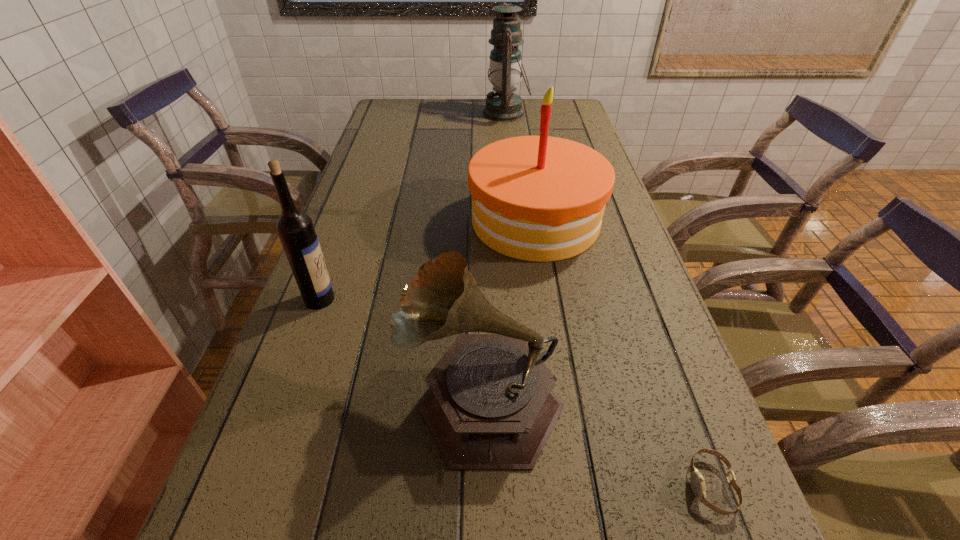
Identify the location of blank region between the shortest object and the second farthest object. The height and width of the screenshot is (540, 960). (623, 353).

Image resolution: width=960 pixels, height=540 pixels. I want to click on free point between the phonograph record and the leftmost object, so click(x=400, y=348).

Choose which object is the third nearest neighbor to the fourth tallest object. Please provide its 2D coordinates. Your answer should be formatted as a tuple, i.e. [(x, y)], where the tuple contains the x and y coordinates of a point satisfying the conditions above.

[(536, 198)]

The height and width of the screenshot is (540, 960). Identify the location of the second closest object to the fourth tallest object. (295, 228).